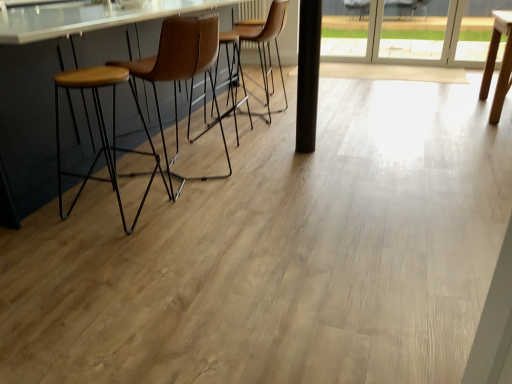
You are a GUI agent. You are given a task and a screenshot of the screen. Output one action in this format:
    pyautogui.click(x=<x>, y=<y>)
    Task: Click on the vacant space to the right of brown leather stool at left, the second chair viewed from the back
    
    Given the screenshot: What is the action you would take?
    pyautogui.click(x=265, y=165)